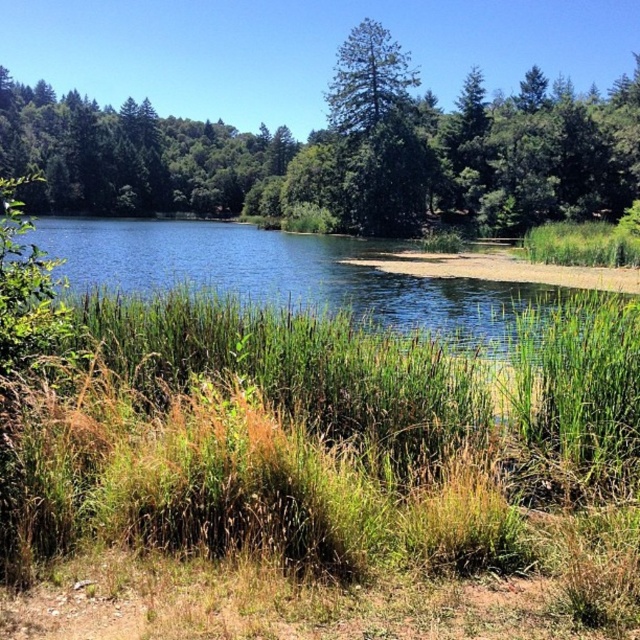
You are standing at the edge of the lake and want to walk towards the green textured tree at center and the blue water at center. Which one will you reach first?

You will reach the green textured tree at center first because it is closer to you than the blue water at center, which is further away.

You are standing at the edge of the water in the scene. There is a point marked at coordinates [324,460]. What is located at this point?

The green grassy area at lower center is located at point [324,460].

You are standing at the edge of the lake and notice the green grassy at lower center and the blue water at center. Which object is located to the right of the other?

The green grassy at lower center is positioned on the right side of blue water at center.